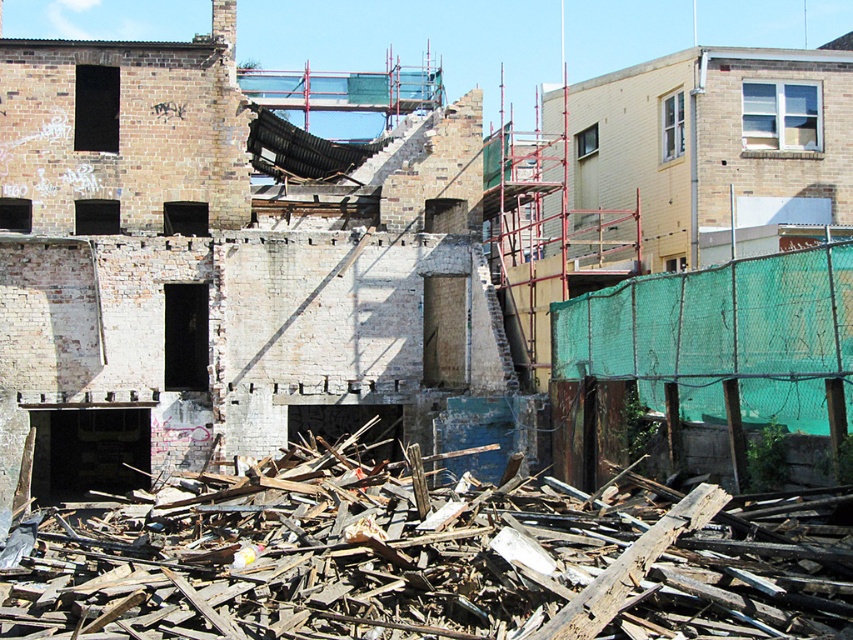
You are a construction worker assessing the site. You see the brick wall at left and the wooden debris at lower center. Which object is positioned higher relative to the other?

The brick wall at left is located above the wooden debris at lower center, so it is positioned higher.

You are a construction worker assessing the site. You need to determine which object takes up more space in the image. Which is larger in size between the brick wall at left and the wooden debris at lower center?

The brick wall at left is bigger than the wooden debris at lower center, so the brick wall at left takes up more space in the image.